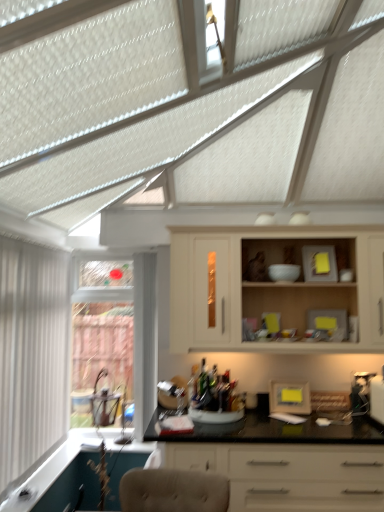
This screenshot has height=512, width=384. Identify the location of matte cream cabinet at center. (259, 287).

Looking at this image, measure the distance between point (x=280, y=387) and camera.

Point (x=280, y=387) is 2.95 meters from camera.

Locate an element on the screen. yellow matte frame at center is located at coordinates (289, 397).

Locate an element on the screen. white vertical blinds at left, which ranks as the 1th window in front-to-back order is located at coordinates (32, 354).

Looking at this image, is matte cream cabinet at center thinner than yellow matte frame at center?

Incorrect, the width of matte cream cabinet at center is not less than that of yellow matte frame at center.

Could you tell me if matte cream cabinet at center is turned towards yellow matte frame at center?

No, matte cream cabinet at center is not facing towards yellow matte frame at center.

From a real-world perspective, between matte cream cabinet at center and yellow matte frame at center, who is vertically higher?

matte cream cabinet at center is physically above.

Is matte cream cabinet at center far from yellow matte frame at center?

They are positioned close to each other.

Would you consider white vertical blinds at left, the 2th window from the back, to be distant from black glossy countertop at center?

Yes, white vertical blinds at left, the 2th window from the back, and black glossy countertop at center are located far from each other.

From a real-world perspective, is white vertical blinds at left, which ranks as the 1th window in front-to-back order, positioned over black glossy countertop at center based on gravity?

Indeed, from a real-world perspective, white vertical blinds at left, which ranks as the 1th window in front-to-back order, stands above black glossy countertop at center.

How many degrees apart are the facing directions of white vertical blinds at left, the 2th window from the back, and black glossy countertop at center?

90 degrees separate the facing orientations of white vertical blinds at left, the 2th window from the back, and black glossy countertop at center.

Between white vertical blinds at left, the 2th window from the back, and black glossy countertop at center, which one has smaller width?

white vertical blinds at left, the 2th window from the back.

Considering the relative sizes of yellow matte frame at center and white vertical blinds at left, the 2th window from the back, in the image provided, is yellow matte frame at center bigger than white vertical blinds at left, the 2th window from the back,?

Incorrect, yellow matte frame at center is not larger than white vertical blinds at left, the 2th window from the back.

Where is `appliance on the right of the white vertical blinds at left, which ranks as the 1th window in front-to-back order`? The image size is (384, 512). appliance on the right of the white vertical blinds at left, which ranks as the 1th window in front-to-back order is located at coordinates (289, 397).

Is yellow matte frame at center facing away from white vertical blinds at left, which ranks as the 1th window in front-to-back order?

yellow matte frame at center is not turned away from white vertical blinds at left, which ranks as the 1th window in front-to-back order.

Looking at their sizes, would you say matte cream cabinet at center is wider or thinner than black glossy countertop at center?

In the image, matte cream cabinet at center appears to be more narrow than black glossy countertop at center.

You are a GUI agent. You are given a task and a screenshot of the screen. Output one action in this format:
    pyautogui.click(x=<x>, y=<y>)
    Task: Click on the countertop on the left of matte cream cabinet at center
    The image size is (384, 512).
    Given the screenshot: What is the action you would take?
    pyautogui.click(x=286, y=463)

Can you tell me how much matte cream cabinet at center and black glossy countertop at center differ in facing direction?

The angle between the facing direction of matte cream cabinet at center and the facing direction of black glossy countertop at center is 0.28 degrees.

Is clear glass window at left, positioned as the first window in back-to-front order, looking in the opposite direction of black glossy countertop at center?

No, clear glass window at left, positioned as the first window in back-to-front order, is not facing away from black glossy countertop at center.

From a real-world perspective, which object rests below the other?

black glossy countertop at center is physically lower.

Is clear glass window at left, positioned as the first window in back-to-front order, to the left or to the right of black glossy countertop at center in the image?

Clearly, clear glass window at left, positioned as the first window in back-to-front order, is on the left of black glossy countertop at center in the image.

Between clear glass window at left, positioned as the first window in back-to-front order, and black glossy countertop at center, which one has less height?

black glossy countertop at center.

Consider the image. Would you say white vertical blinds at left, the 2th window from the back, is outside matte cream cabinet at center?

Indeed, white vertical blinds at left, the 2th window from the back, is completely outside matte cream cabinet at center.

Who is bigger, white vertical blinds at left, which ranks as the 1th window in front-to-back order, or matte cream cabinet at center?

With larger size is matte cream cabinet at center.

Which of these two, white vertical blinds at left, the 2th window from the back, or matte cream cabinet at center, is thinner?

Thinner between the two is white vertical blinds at left, the 2th window from the back.

From the image's perspective, does white vertical blinds at left, which ranks as the 1th window in front-to-back order, appear lower than matte cream cabinet at center?

Yes, from the image's perspective, white vertical blinds at left, which ranks as the 1th window in front-to-back order, is below matte cream cabinet at center.

Can we say black glossy countertop at center lies outside yellow matte frame at center?

Yes, black glossy countertop at center is not within yellow matte frame at center.

Considering the sizes of objects black glossy countertop at center and yellow matte frame at center in the image provided, who is wider, black glossy countertop at center or yellow matte frame at center?

black glossy countertop at center.

Is black glossy countertop at center far from yellow matte frame at center?

No.

Is black glossy countertop at center oriented towards yellow matte frame at center?

No, black glossy countertop at center is not turned towards yellow matte frame at center.

The image size is (384, 512). I want to click on appliance on the right of matte cream cabinet at center, so click(289, 397).

At what (x,y) coordinates should I click in order to perform the action: click on window in front of the black glossy countertop at center. Please return your answer as a coordinate pair (x, y). This screenshot has width=384, height=512. Looking at the image, I should click on (32, 354).

Estimate the real-world distances between objects in this image. Which object is closer to white vertical blinds at left, which ranks as the 1th window in front-to-back order, black glossy countertop at center or clear glass window at left, which is the second window from front to back?

clear glass window at left, which is the second window from front to back, is positioned closer to the anchor white vertical blinds at left, which ranks as the 1th window in front-to-back order.

From the image, which object appears to be nearer to matte cream cabinet at center, black glossy countertop at center or yellow matte frame at center?

yellow matte frame at center lies closer to matte cream cabinet at center than the other object.

Based on their spatial positions, is clear glass window at left, which is the second window from front to back, or white vertical blinds at left, the 2th window from the back, closer to yellow matte frame at center?

Based on the image, clear glass window at left, which is the second window from front to back, appears to be nearer to yellow matte frame at center.

Looking at the image, which one is located further to white vertical blinds at left, the 2th window from the back, clear glass window at left, positioned as the first window in back-to-front order, or yellow matte frame at center?

yellow matte frame at center.

Based on their spatial positions, is yellow matte frame at center or black glossy countertop at center closer to white vertical blinds at left, which ranks as the 1th window in front-to-back order?

black glossy countertop at center lies closer to white vertical blinds at left, which ranks as the 1th window in front-to-back order, than the other object.

From the picture: When comparing their distances from yellow matte frame at center, does black glossy countertop at center or white vertical blinds at left, the 2th window from the back, seem closer?

black glossy countertop at center is closer to yellow matte frame at center.

Which object lies nearer to the anchor point matte cream cabinet at center, yellow matte frame at center or white vertical blinds at left, which ranks as the 1th window in front-to-back order?

yellow matte frame at center.

Estimate the real-world distances between objects in this image. Which object is closer to black glossy countertop at center, white vertical blinds at left, the 2th window from the back, or yellow matte frame at center?

yellow matte frame at center is closer to black glossy countertop at center.

You are a GUI agent. You are given a task and a screenshot of the screen. Output one action in this format:
    pyautogui.click(x=<x>, y=<y>)
    Task: Click on the cabinetry located between white vertical blinds at left, which ranks as the 1th window in front-to-back order, and yellow matte frame at center in the left-right direction
    
    Given the screenshot: What is the action you would take?
    pyautogui.click(x=259, y=287)

This screenshot has width=384, height=512. In order to click on window between white vertical blinds at left, the 2th window from the back, and yellow matte frame at center in this screenshot , I will do `click(116, 335)`.

At what (x,y) coordinates should I click in order to perform the action: click on window located between white vertical blinds at left, the 2th window from the back, and black glossy countertop at center in the left-right direction. Please return your answer as a coordinate pair (x, y). The image size is (384, 512). Looking at the image, I should click on (116, 335).

This screenshot has width=384, height=512. What are the coordinates of `cabinetry between clear glass window at left, positioned as the first window in back-to-front order, and yellow matte frame at center, in the horizontal direction` in the screenshot? It's located at (259, 287).